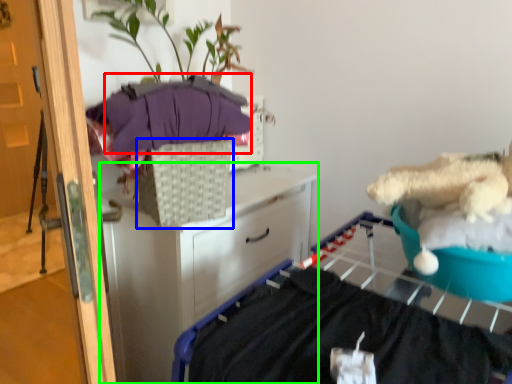
Question: Which object is positioned closest to clothing (highlighted by a red box)? Select from basket (highlighted by a blue box) and chest of drawers (highlighted by a green box).

Choices:
 (A) basket
 (B) chest of drawers

Answer: (A)